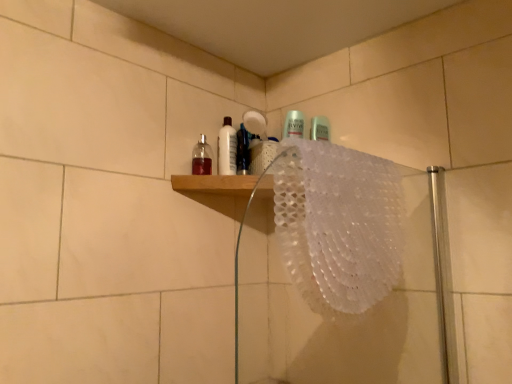
Question: Does white textured bath towel at upper right lie behind semi-transparent plastic mouthwash at upper center, arranged as the 3th mouthwash when viewed from the left?

Choices:
 (A) yes
 (B) no

Answer: (B)

Question: Is white textured bath towel at upper right outside semi-transparent plastic mouthwash at upper center, arranged as the 3th mouthwash when viewed from the left?

Choices:
 (A) yes
 (B) no

Answer: (A)

Question: Is white textured bath towel at upper right oriented towards semi-transparent plastic mouthwash at upper center, which is the first mouthwash from right to left?

Choices:
 (A) no
 (B) yes

Answer: (A)

Question: Is the depth of white textured bath towel at upper right less than that of semi-transparent plastic mouthwash at upper center, which is the first mouthwash from right to left?

Choices:
 (A) yes
 (B) no

Answer: (A)

Question: Considering the relative sizes of white textured bath towel at upper right and semi-transparent plastic mouthwash at upper center, arranged as the 3th mouthwash when viewed from the left, in the image provided, is white textured bath towel at upper right smaller than semi-transparent plastic mouthwash at upper center, arranged as the 3th mouthwash when viewed from the left,?

Choices:
 (A) yes
 (B) no

Answer: (B)

Question: Is white textured bath towel at upper right taller or shorter than semi-transparent plastic mouthwash at upper center, arranged as the 3th mouthwash when viewed from the left?

Choices:
 (A) tall
 (B) short

Answer: (A)

Question: Would you say white textured bath towel at upper right is inside or outside semi-transparent plastic mouthwash at upper center, which is the first mouthwash from right to left?

Choices:
 (A) outside
 (B) inside

Answer: (A)

Question: Considering their positions, is white textured bath towel at upper right located in front of or behind semi-transparent plastic mouthwash at upper center, which is the first mouthwash from right to left?

Choices:
 (A) front
 (B) behind

Answer: (A)

Question: Considering the positions of point (x=380, y=223) and point (x=237, y=147), is point (x=380, y=223) closer or farther from the camera than point (x=237, y=147)?

Choices:
 (A) farther
 (B) closer

Answer: (B)

Question: From their relative heights in the image, would you say translucent glass bottle at upper center, positioned as the first mouthwash in left-to-right order, is taller or shorter than white lace doily at upper center?

Choices:
 (A) short
 (B) tall

Answer: (A)

Question: From the image's perspective, is translucent glass bottle at upper center, which is the 3th mouthwash from right to left, located above or below white lace doily at upper center?

Choices:
 (A) below
 (B) above

Answer: (B)

Question: Considering the relative positions of translucent glass bottle at upper center, positioned as the first mouthwash in left-to-right order, and white lace doily at upper center in the image provided, is translucent glass bottle at upper center, positioned as the first mouthwash in left-to-right order, to the left or to the right of white lace doily at upper center?

Choices:
 (A) left
 (B) right

Answer: (A)

Question: Is translucent glass bottle at upper center, positioned as the first mouthwash in left-to-right order, wider or thinner than white lace doily at upper center?

Choices:
 (A) wide
 (B) thin

Answer: (B)

Question: From the image's perspective, is white textured bath towel at upper right positioned above or below white glossy bottle at upper center, the 2th mouthwash when ordered from left to right?

Choices:
 (A) below
 (B) above

Answer: (A)

Question: Based on their positions, is white textured bath towel at upper right located to the left or right of white glossy bottle at upper center, the 2th mouthwash when ordered from left to right?

Choices:
 (A) left
 (B) right

Answer: (B)